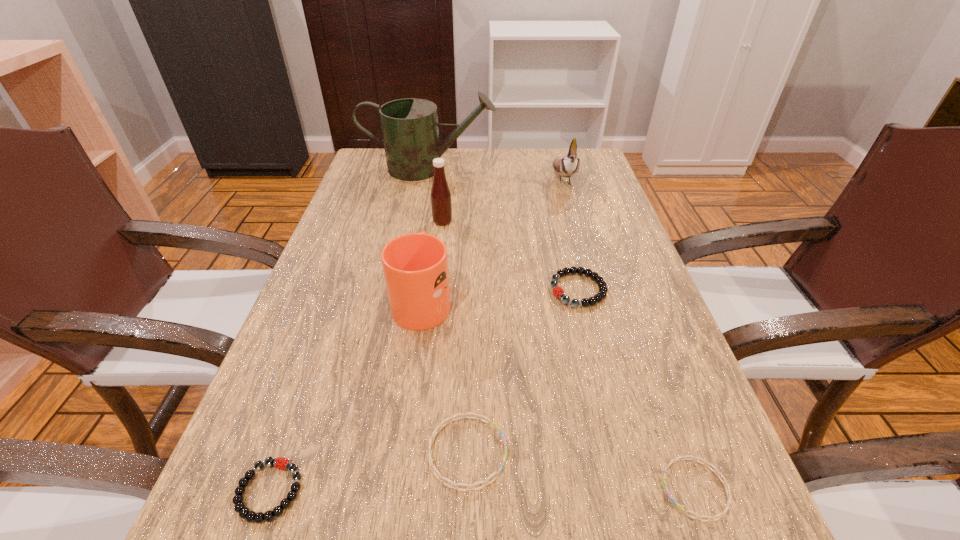
Locate an element on the screen. The width and height of the screenshot is (960, 540). the nearer black bracelet is located at coordinates (244, 512).

Image resolution: width=960 pixels, height=540 pixels. In order to click on the left black bracelet in this screenshot , I will do `click(244, 512)`.

Find the location of a particular element. the shortest object is located at coordinates (722, 514).

Locate an element on the screen. The width and height of the screenshot is (960, 540). the shortest bracelet is located at coordinates (722, 514).

This screenshot has width=960, height=540. What are the coordinates of `free point located 0.280m with the spout on the green watering can` in the screenshot? It's located at (588, 168).

Image resolution: width=960 pixels, height=540 pixels. I want to click on vacant space located on the back of the Tabasco sauce, so click(x=446, y=188).

This screenshot has width=960, height=540. What are the coordinates of `vacant region located at the face of the bird` in the screenshot? It's located at (580, 238).

The height and width of the screenshot is (540, 960). In order to click on vacant space situated 0.290m on the handle side of the mug in this screenshot , I will do `click(436, 204)`.

This screenshot has width=960, height=540. Identify the location of vacant space situated on the handle side of the mug. (429, 251).

The image size is (960, 540). I want to click on vacant space located 0.120m on the handle side of the mug, so click(x=431, y=241).